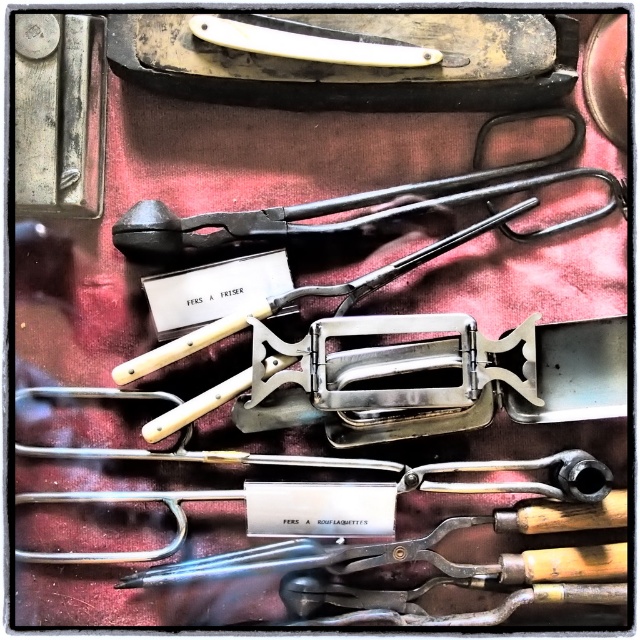
Which is above, white plastic straight razor at upper center or metallic silver tool at center?

white plastic straight razor at upper center

Identify the location of white plastic straight razor at upper center. This screenshot has width=640, height=640. (314, 42).

Identify the location of white plastic straight razor at upper center. The height and width of the screenshot is (640, 640). [314, 42].

Is point (284, 221) in front of point (353, 45)?

No, (284, 221) is behind (353, 45).

Between black matte tongs at upper center and white plastic straight razor at upper center, which one has more height?

With more height is black matte tongs at upper center.

Is point (486, 122) positioned after point (291, 49)?

That is True.

Where is `black matte tongs at upper center`? The image size is (640, 640). black matte tongs at upper center is located at coordinates (330, 204).

Is black matte tongs at upper center above metallic silver tool at center?

Indeed, black matte tongs at upper center is positioned over metallic silver tool at center.

Can you confirm if black matte tongs at upper center is wider than metallic silver tool at center?

Yes, black matte tongs at upper center is wider than metallic silver tool at center.

Does point (508, 115) come closer to viewer compared to point (468, 227)?

Yes.

Find the location of a particular element. black matte tongs at upper center is located at coordinates (330, 204).